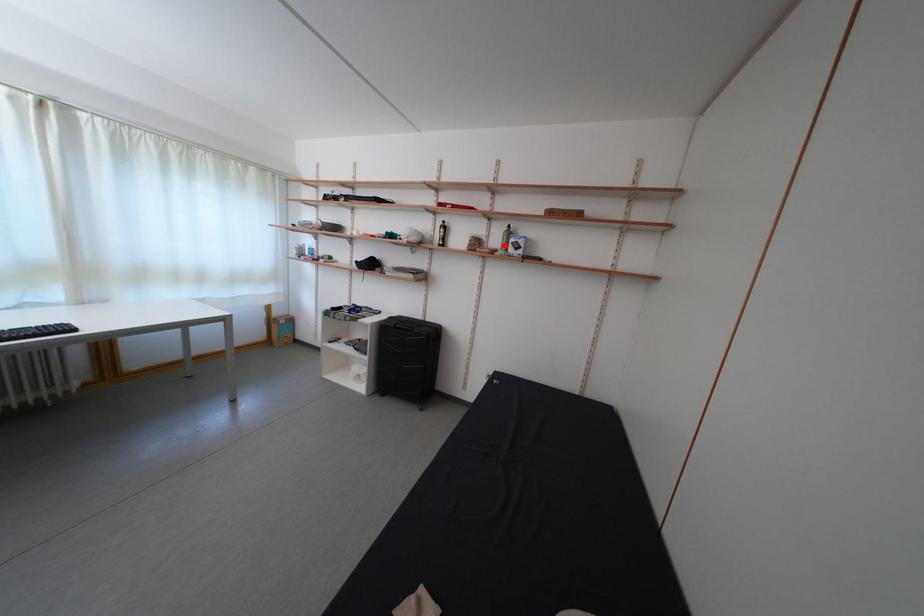
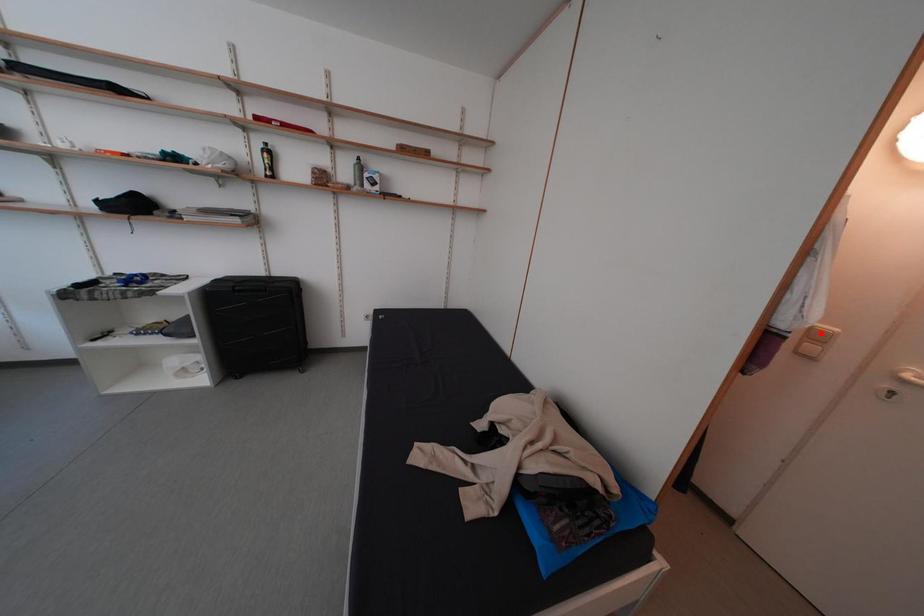
I am providing you with two images of the same scene from different viewpoints. A red point is marked on the first image and another point is marked on the second image. Is the marked point in image1 the same physical position as the marked point in image2?

No